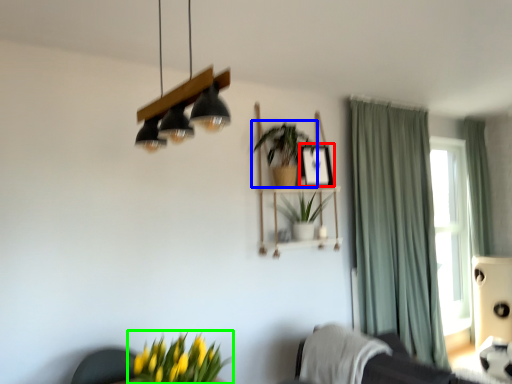
Question: Which object is positioned closest to picture frame (highlighted by a red box)? Select from houseplant (highlighted by a blue box) and houseplant (highlighted by a green box).

Choices:
 (A) houseplant
 (B) houseplant

Answer: (A)